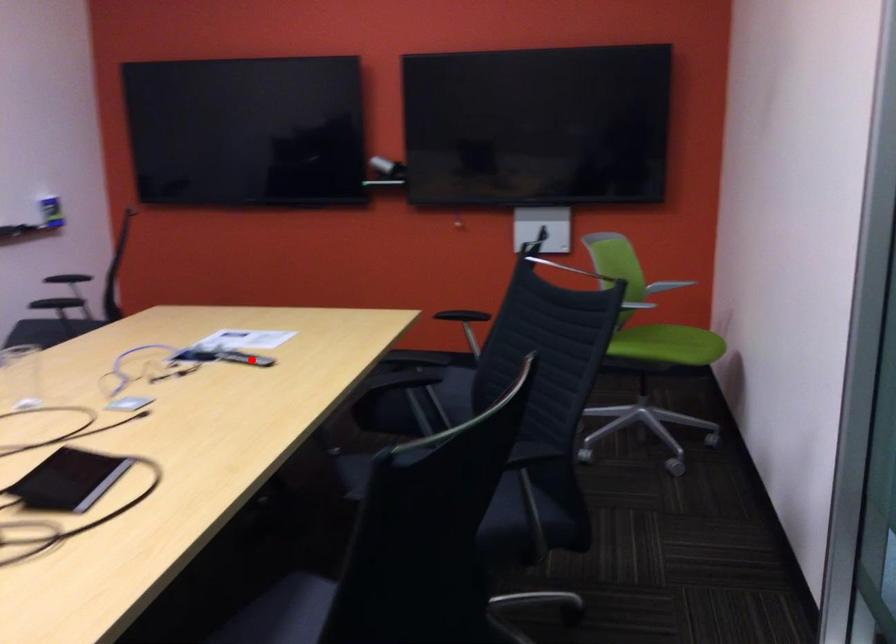
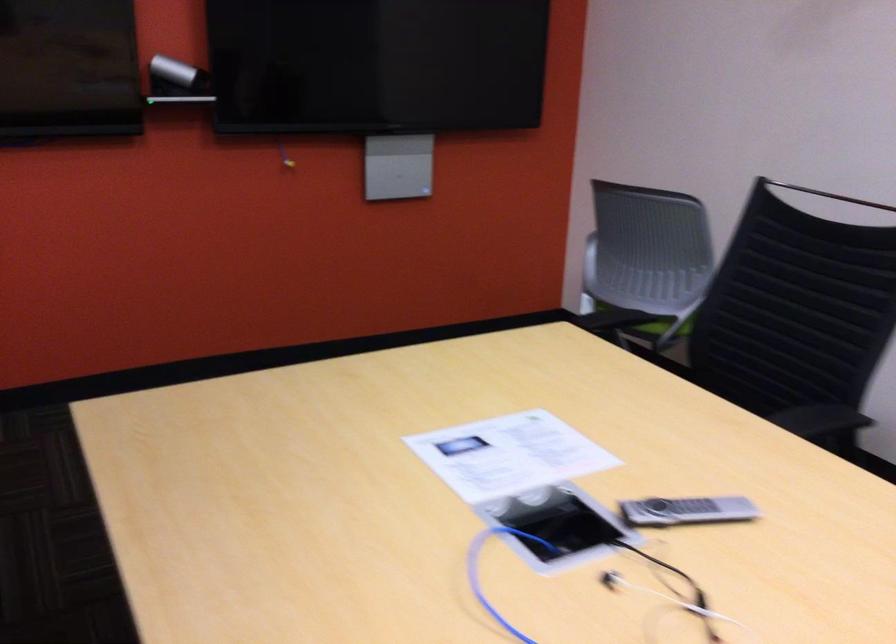
The point at the highlighted location is marked in the first image. Where is the corresponding point in the second image?

(686, 511)